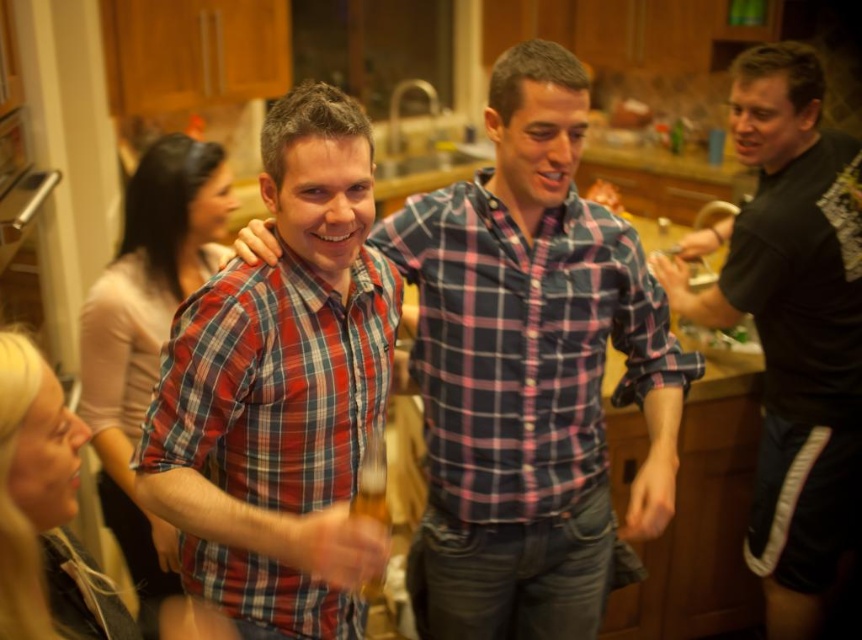
Question: Estimate the real-world distances between objects in this image. Which object is closer to the plaid cotton shirt at center?

Choices:
 (A) red plaid shirt at center
 (B) black matte shirt at right
 (C) plaid shirt at center

Answer: (C)

Question: Does black matte shirt at right have a larger size compared to red plaid shirt at center?

Choices:
 (A) no
 (B) yes

Answer: (B)

Question: Among these points, which one is farthest from the camera?

Choices:
 (A) click(673, 376)
 (B) click(298, 484)
 (C) click(659, 353)
 (D) click(765, 186)

Answer: (D)

Question: Which object is closer to the camera taking this photo?

Choices:
 (A) red plaid shirt at center
 (B) plaid cotton shirt at center

Answer: (A)

Question: Observing the image, what is the correct spatial positioning of black matte shirt at right in reference to red plaid shirt at center?

Choices:
 (A) above
 (B) below

Answer: (A)

Question: Is black matte shirt at right to the right of red plaid shirt at center from the viewer's perspective?

Choices:
 (A) no
 (B) yes

Answer: (B)